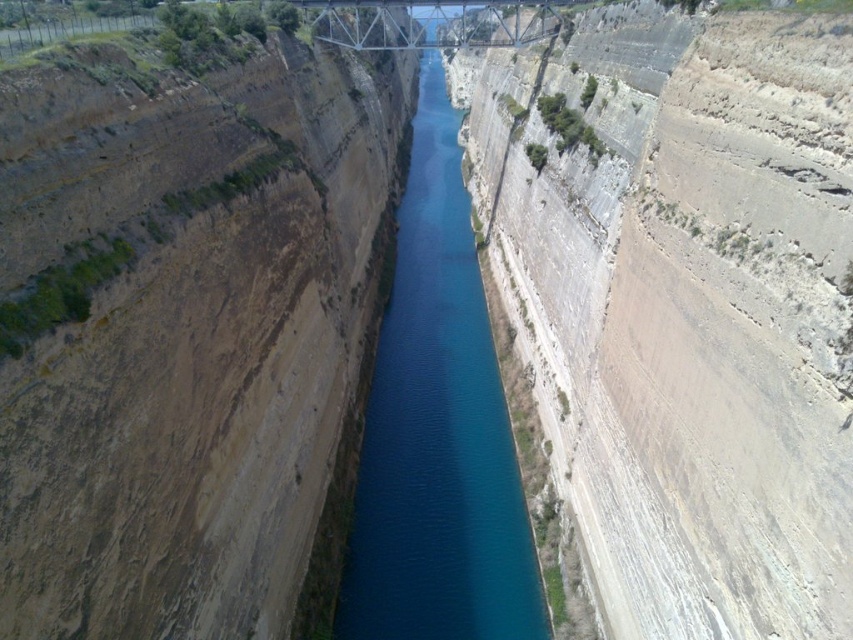
Question: Does brown rocky cliff at left appear on the left side of metallic steel bridge at upper center?

Choices:
 (A) yes
 (B) no

Answer: (A)

Question: Is blue smooth water at center wider than metallic steel bridge at upper center?

Choices:
 (A) yes
 (B) no

Answer: (B)

Question: Is blue smooth water at center closer to the viewer compared to metallic steel bridge at upper center?

Choices:
 (A) yes
 (B) no

Answer: (A)

Question: Which of these objects is positioned closest to the brown rocky cliff at left?

Choices:
 (A) blue smooth water at center
 (B) metallic steel bridge at upper center

Answer: (A)

Question: Which point is closer to the camera?

Choices:
 (A) blue smooth water at center
 (B) brown rocky cliff at left
 (C) metallic steel bridge at upper center

Answer: (B)

Question: Which of these objects is positioned closest to the blue smooth water at center?

Choices:
 (A) metallic steel bridge at upper center
 (B) brown rocky cliff at left

Answer: (B)